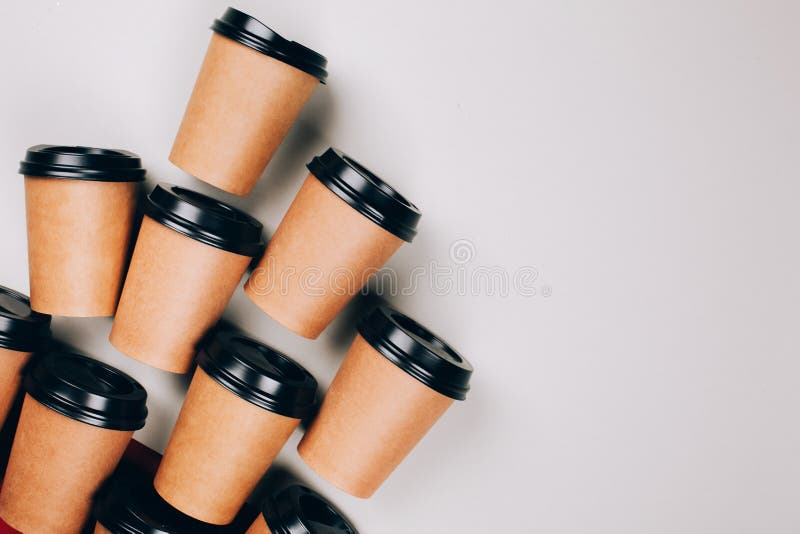
Find the location of `coffee cups`. coffee cups is located at coordinates (248, 109), (306, 243), (188, 257), (62, 242), (65, 431), (4, 365), (208, 423), (392, 414).